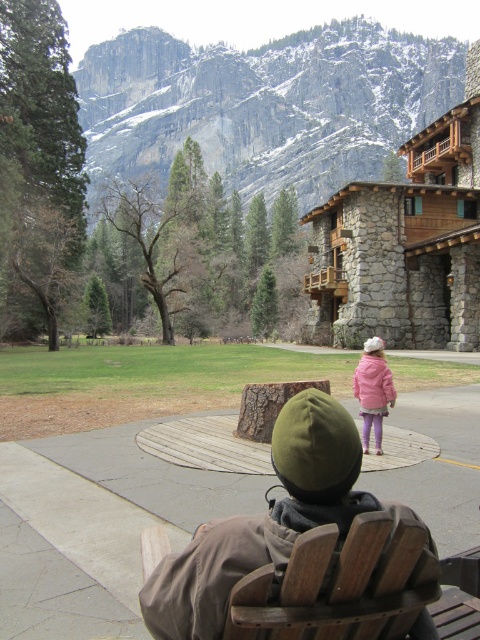
You are planning to take a photo of the gray rocky mountain at upper center and the wooden chair at center from a position where both are visible. Which object will appear wider in the photo?

The gray rocky mountain at upper center will appear wider in the photo because its width is larger than the wooden chair at center.

You are sitting on the wooden chair at center and looking towards the gray rocky mountain at upper center. Which object is closer to you?

The wooden chair at center is closer to you since you are sitting on it, while the gray rocky mountain at upper center is further away.

You are standing in the outdoor scene and want to take a photo of both the gray rocky mountain at upper center and the matte pink coat at center. Which object should you focus on first to ensure both are in clear view?

You should focus on the matte pink coat at center first because it is closer to you than the gray rocky mountain at upper center, which is further away. This way, both will be in focus when you adjust the camera settings accordingly.